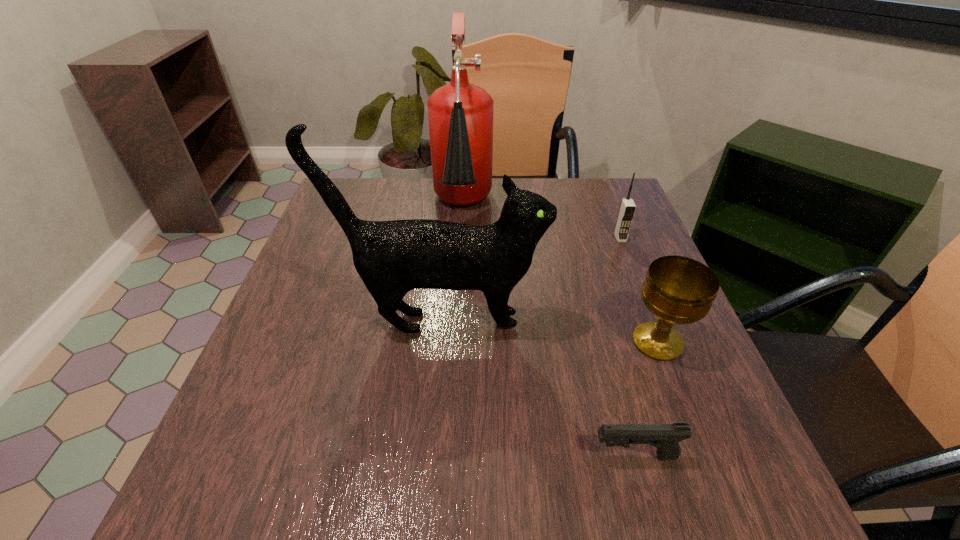
Locate an element on the screen. This screenshot has width=960, height=540. free point between the cellular telephone and the cat is located at coordinates pyautogui.click(x=531, y=280).

At what (x,y) coordinates should I click in order to perform the action: click on the second closest object to the cellular telephone. Please return your answer as a coordinate pair (x, y). The width and height of the screenshot is (960, 540). Looking at the image, I should click on (392, 258).

I want to click on object that ranks as the fourth closest to the chalice, so click(460, 115).

Image resolution: width=960 pixels, height=540 pixels. I want to click on free space that satisfies the following two spatial constraints: 1. with the nozzle aimed from the fire extinguisher; 2. on the right side of the chalice, so click(x=455, y=342).

Where is `free point that satisfies the following two spatial constraints: 1. on the front-facing side of the cellular telephone; 2. on the face of the cat`? The width and height of the screenshot is (960, 540). free point that satisfies the following two spatial constraints: 1. on the front-facing side of the cellular telephone; 2. on the face of the cat is located at coordinates (653, 322).

Where is `vacant space that satisfies the following two spatial constraints: 1. with the nozzle aimed from the fire extinguisher; 2. on the face of the cat`? vacant space that satisfies the following two spatial constraints: 1. with the nozzle aimed from the fire extinguisher; 2. on the face of the cat is located at coordinates (456, 322).

Locate an element on the screen. This screenshot has height=540, width=960. vacant area in the image that satisfies the following two spatial constraints: 1. with the nozzle aimed from the fire extinguisher; 2. on the face of the cat is located at coordinates click(x=456, y=322).